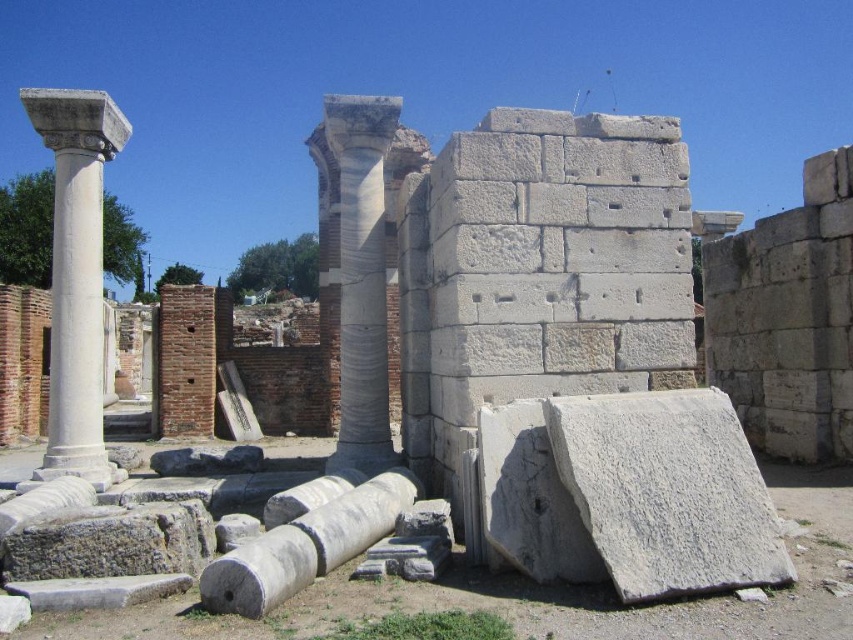
You are an archaeologist standing at the center of the ruins. You need to locate the white marble column at left. According to the coordinates provided, in which direction should you move to find it?

The white marble column at left is located at point (76, 273). Since you are at the center, you should move towards the left direction to find it.

You are an archaeologist examining the ruins. You see the white marble column at left and the white marble column at center. Which column is nearer to you?

The white marble column at left is closer to the viewer than the white marble column at center.